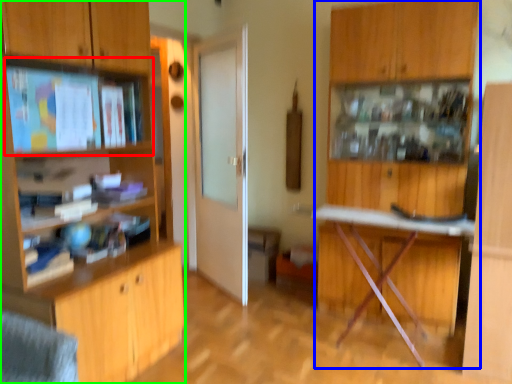
Question: Which is farther away from shelf (highlighted by a red box)? dresser (highlighted by a blue box) or cabinetry (highlighted by a green box)?

Choices:
 (A) dresser
 (B) cabinetry

Answer: (A)